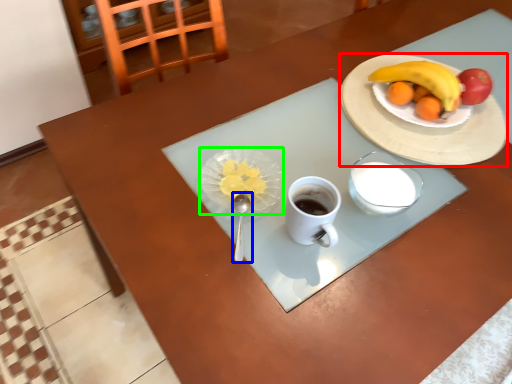
Question: Which object is positioned farthest from plate (highlighted by a red box)? Select from utensil (highlighted by a blue box) and tableware (highlighted by a green box).

Choices:
 (A) utensil
 (B) tableware

Answer: (A)